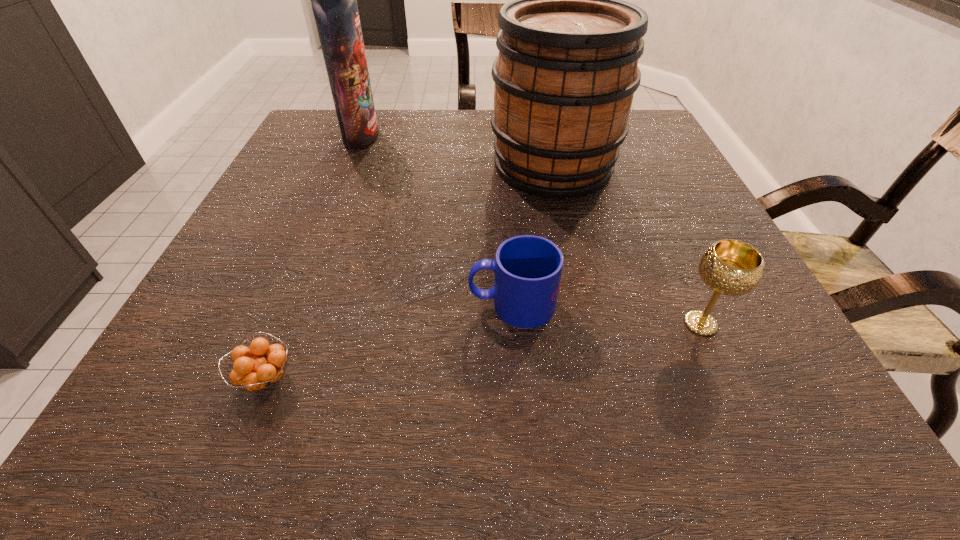
Image resolution: width=960 pixels, height=540 pixels. Find the location of `vacant space located on the side with the handle of the second shortest object`. vacant space located on the side with the handle of the second shortest object is located at coordinates [399, 305].

Find the location of a particular element. The height and width of the screenshot is (540, 960). vacant space located 0.090m on the side with the handle of the second shortest object is located at coordinates (412, 305).

I want to click on vacant region located 0.280m on the right of the nearest object, so click(502, 379).

Find the location of a particular element. The height and width of the screenshot is (540, 960). shampoo that is at the far edge is located at coordinates (334, 0).

Locate an element on the screen. This screenshot has width=960, height=540. cider that is at the far edge is located at coordinates (567, 69).

At what (x,y) coordinates should I click in order to perform the action: click on object present at the near edge. Please return your answer as a coordinate pair (x, y). The width and height of the screenshot is (960, 540). Looking at the image, I should click on (258, 373).

Where is `shampoo at the left edge`? Image resolution: width=960 pixels, height=540 pixels. shampoo at the left edge is located at coordinates (334, 0).

Identify the location of orange fruit positioned at the left edge. coord(258,373).

Locate an element on the screen. This screenshot has width=960, height=540. cider positioned at the right edge is located at coordinates (567, 69).

The height and width of the screenshot is (540, 960). I want to click on chalice present at the right edge, so click(730, 267).